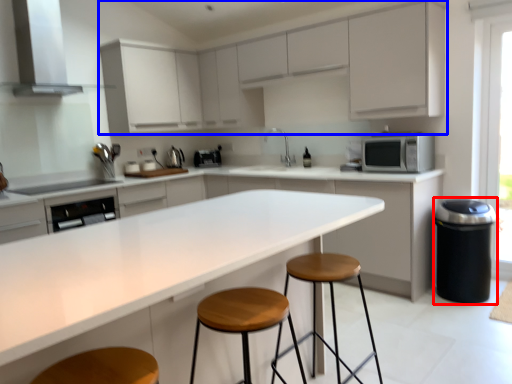
Question: Which of the following is the farthest to the observer, appliance (highlighted by a red box) or cabinetry (highlighted by a blue box)?

Choices:
 (A) appliance
 (B) cabinetry

Answer: (A)